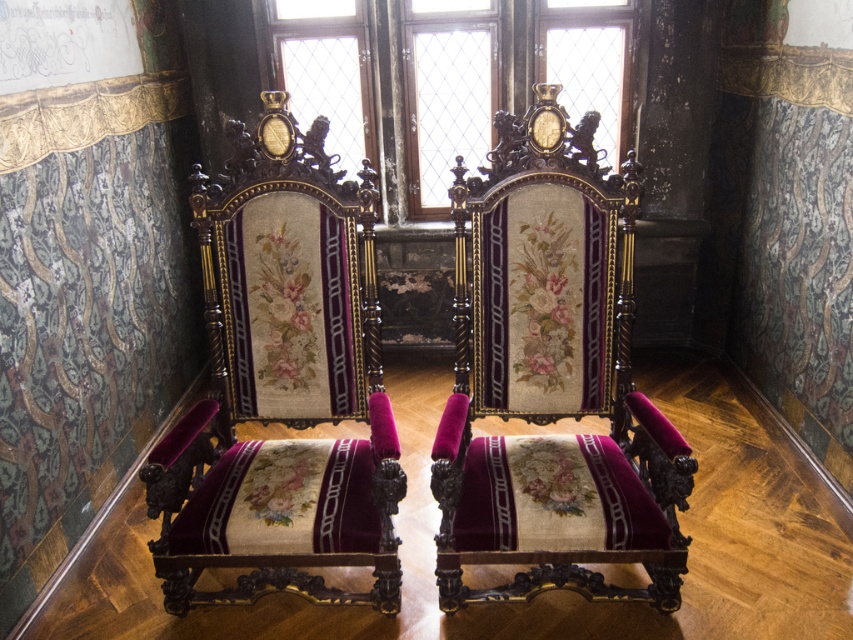
You are standing in a historic room with two ornate chairs. You notice two points marked on the floor at coordinates point (178, 449) and point (589, 54). If you were to walk from the first point to the second, would you be moving towards the chairs or away from them?

Point (178, 449) is in front of point (589, 54). Therefore, walking from the first point to the second would mean moving away from the chairs.

You are a delivery person standing in the room and need to place a package that is 1.8 meters long between the velvetvelvetarmchair at left and the viewer. Is there enough space to place the package horizontally without tilting it?

The distance between the velvetvelvetarmchair at left and the viewer is 1.78 meters. Since the package is 1.8 meters long, which is slightly longer than the available space, the package cannot be placed horizontally between them without tilting it.